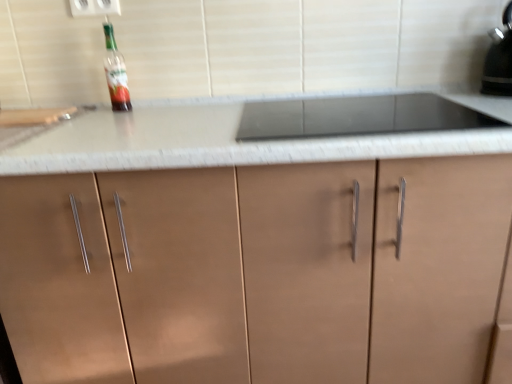
Describe the element at coordinates (499, 59) in the screenshot. This screenshot has width=512, height=384. I see `black glossy kettle at upper right` at that location.

Find the location of `matte brown cabinet at center`. matte brown cabinet at center is located at coordinates (271, 270).

From the image's perspective, is black glossy kettle at upper right located above white plastic electric outlet at upper center?

No, from the image's perspective, black glossy kettle at upper right is not above white plastic electric outlet at upper center.

Considering the positions of points (486, 72) and (108, 9), is point (486, 72) closer to camera compared to point (108, 9)?

No, it is behind (108, 9).

From a real-world perspective, is black glossy kettle at upper right above or below white plastic electric outlet at upper center?

In terms of real-world spatial position, black glossy kettle at upper right is below white plastic electric outlet at upper center.

Relative to white plastic electric outlet at upper center, is black glossy kettle at upper right in front or behind?

black glossy kettle at upper right is in front of white plastic electric outlet at upper center.

Can you confirm if translucent glass bottle at upper left is positioned to the left of matte brown cabinet at center?

Correct, you'll find translucent glass bottle at upper left to the left of matte brown cabinet at center.

In the scene shown: Is translucent glass bottle at upper left inside the boundaries of matte brown cabinet at center, or outside?

translucent glass bottle at upper left lies outside matte brown cabinet at center.

Based on their sizes in the image, would you say translucent glass bottle at upper left is bigger or smaller than matte brown cabinet at center?

Clearly, translucent glass bottle at upper left is smaller in size than matte brown cabinet at center.

Does translucent glass bottle at upper left have a greater width compared to matte brown cabinet at center?

No, translucent glass bottle at upper left is not wider than matte brown cabinet at center.

Is point (504, 92) farther from viewer compared to point (251, 334)?

Yes, it is behind point (251, 334).

Based on the photo, from a real-world perspective, who is located lower, black glossy kettle at upper right or matte brown cabinet at center?

From a 3D spatial view, matte brown cabinet at center is below.

Is black glossy kettle at upper right facing towards matte brown cabinet at center?

No, black glossy kettle at upper right is not oriented towards matte brown cabinet at center.

In the image, is black glossy kettle at upper right on the left side or the right side of matte brown cabinet at center?

From the image, it's evident that black glossy kettle at upper right is to the right of matte brown cabinet at center.

From the image's perspective, between matte brown cabinet at center and black glossy kettle at upper right, who is located below?

matte brown cabinet at center appears lower in the image.

Is matte brown cabinet at center aimed at black glossy kettle at upper right?

No, matte brown cabinet at center does not turn towards black glossy kettle at upper right.

Considering the relative sizes of white plastic electric outlet at upper center and translucent glass bottle at upper left in the image provided, is white plastic electric outlet at upper center wider than translucent glass bottle at upper left?

No, white plastic electric outlet at upper center is not wider than translucent glass bottle at upper left.

Is white plastic electric outlet at upper center to the right of translucent glass bottle at upper left from the viewer's perspective?

No, white plastic electric outlet at upper center is not to the right of translucent glass bottle at upper left.

Is white plastic electric outlet at upper center placed right next to translucent glass bottle at upper left?

There is a gap between white plastic electric outlet at upper center and translucent glass bottle at upper left.

Is point (74, 15) closer to viewer compared to point (124, 110)?

Yes, point (74, 15) is in front of point (124, 110).

Choose the correct answer: Is matte brown cabinet at center inside translucent glass bottle at upper left or outside it?

matte brown cabinet at center is located beyond the bounds of translucent glass bottle at upper left.

Considering the positions of objects matte brown cabinet at center and translucent glass bottle at upper left in the image provided, who is behind, matte brown cabinet at center or translucent glass bottle at upper left?

translucent glass bottle at upper left is behind.

From the image's perspective, between matte brown cabinet at center and translucent glass bottle at upper left, who is located below?

From the image's view, matte brown cabinet at center is below.

Locate an element on the screen. The image size is (512, 384). cabinetry that appears on the right of translucent glass bottle at upper left is located at coordinates (271, 270).

Is there a large distance between translucent glass bottle at upper left and black glossy kettle at upper right?

That's right, there is a large distance between translucent glass bottle at upper left and black glossy kettle at upper right.

From the image's perspective, which is above, translucent glass bottle at upper left or black glossy kettle at upper right?

From the image's view, black glossy kettle at upper right is above.

Is point (116, 73) positioned after point (508, 34)?

That is True.

Where is `electric outlet that appears behind the black glossy kettle at upper right`? The width and height of the screenshot is (512, 384). electric outlet that appears behind the black glossy kettle at upper right is located at coordinates (94, 7).

Where is `cabinetry that appears below the translucent glass bottle at upper left (from a real-world perspective)`? The width and height of the screenshot is (512, 384). cabinetry that appears below the translucent glass bottle at upper left (from a real-world perspective) is located at coordinates (271, 270).

From the image, which object appears to be farther from translucent glass bottle at upper left, white plastic electric outlet at upper center or matte brown cabinet at center?

matte brown cabinet at center is further to translucent glass bottle at upper left.

Which object lies further to the anchor point translucent glass bottle at upper left, black glossy kettle at upper right or white plastic electric outlet at upper center?

black glossy kettle at upper right.

From the image, which object appears to be farther from black glossy kettle at upper right, translucent glass bottle at upper left or matte brown cabinet at center?

The object further to black glossy kettle at upper right is translucent glass bottle at upper left.

Based on their spatial positions, is black glossy kettle at upper right or translucent glass bottle at upper left closer to matte brown cabinet at center?

Based on the image, translucent glass bottle at upper left appears to be nearer to matte brown cabinet at center.

Looking at the image, which one is located closer to matte brown cabinet at center, translucent glass bottle at upper left or white plastic electric outlet at upper center?

translucent glass bottle at upper left lies closer to matte brown cabinet at center than the other object.

From the image, which object appears to be nearer to white plastic electric outlet at upper center, matte brown cabinet at center or translucent glass bottle at upper left?

translucent glass bottle at upper left.

Which object lies further to the anchor point matte brown cabinet at center, white plastic electric outlet at upper center or translucent glass bottle at upper left?

white plastic electric outlet at upper center is positioned further to the anchor matte brown cabinet at center.

Which object lies nearer to the anchor point translucent glass bottle at upper left, matte brown cabinet at center or black glossy kettle at upper right?

matte brown cabinet at center is closer to translucent glass bottle at upper left.

Find the location of `bottle between white plastic electric outlet at upper center and black glossy kettle at upper right in the horizontal direction`. bottle between white plastic electric outlet at upper center and black glossy kettle at upper right in the horizontal direction is located at coordinates (116, 73).

The image size is (512, 384). I want to click on bottle that lies between white plastic electric outlet at upper center and matte brown cabinet at center from top to bottom, so (x=116, y=73).

This screenshot has height=384, width=512. What are the coordinates of `cabinetry between translucent glass bottle at upper left and black glossy kettle at upper right from left to right` in the screenshot? It's located at (271, 270).

The image size is (512, 384). I want to click on cabinetry between white plastic electric outlet at upper center and black glossy kettle at upper right in the horizontal direction, so click(x=271, y=270).